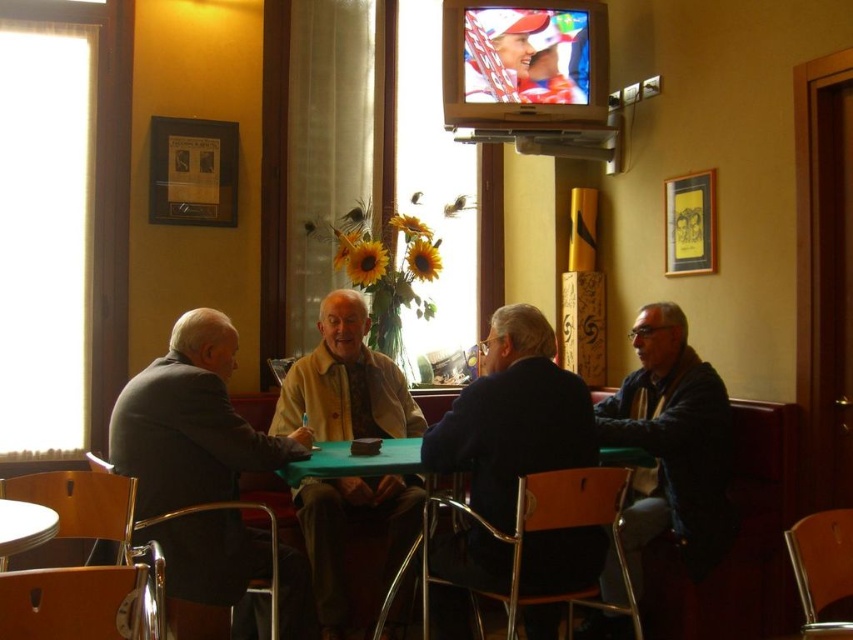
Is dark gray suit at left behind green fabric table at center?

No, dark gray suit at left is in front of green fabric table at center.

Find the location of a particular element. dark gray suit at left is located at coordinates (190, 422).

Can you confirm if dark gray suit at left is positioned below dark blue jacket at right?

Correct, dark gray suit at left is located below dark blue jacket at right.

Locate an element on the screen. dark gray suit at left is located at coordinates (190, 422).

This screenshot has width=853, height=640. Identify the location of dark gray suit at left. (190, 422).

Between dark blue jacket at center and dark blue jacket at right, which one has less height?

dark blue jacket at center

From the picture: Can you confirm if dark blue jacket at center is positioned above dark blue jacket at right?

Indeed, dark blue jacket at center is positioned over dark blue jacket at right.

The width and height of the screenshot is (853, 640). I want to click on dark blue jacket at center, so click(514, 417).